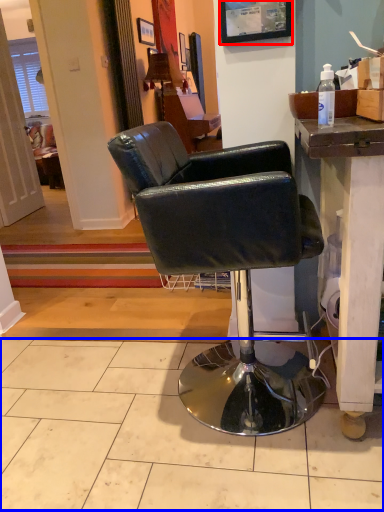
Question: Among these objects, which one is nearest to the camera, picture frame (highlighted by a red box) or tile (highlighted by a blue box)?

Choices:
 (A) picture frame
 (B) tile

Answer: (B)